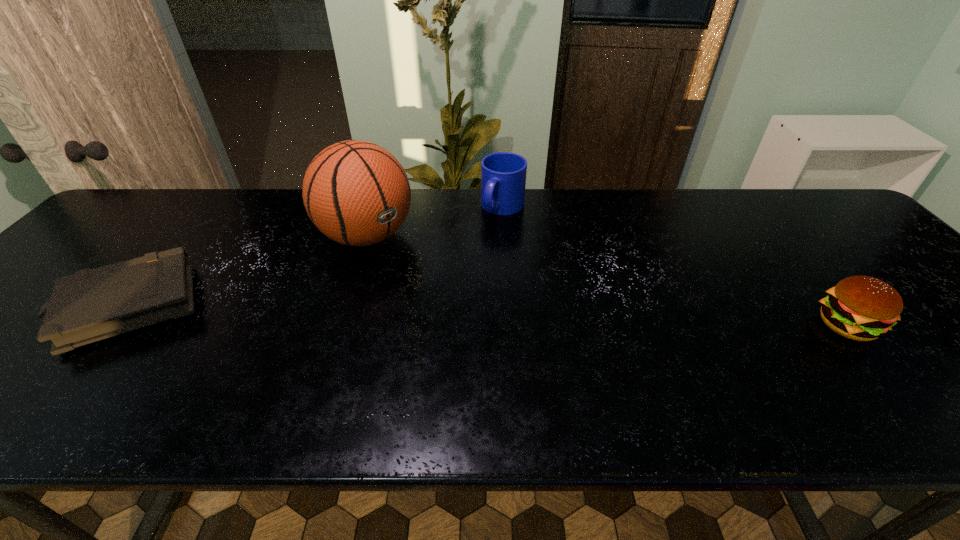
Identify the location of free spot between the leftmost object and the third object from left to right. This screenshot has height=540, width=960. (316, 256).

Identify the location of free area in between the hamburger and the third object from right to left. (607, 281).

You are a GUI agent. You are given a task and a screenshot of the screen. Output one action in this format:
    pyautogui.click(x=<x>, y=<y>)
    Task: Click on the free spot between the second object from left to right and the leftmost object
    Image resolution: width=960 pixels, height=540 pixels.
    Given the screenshot: What is the action you would take?
    pyautogui.click(x=248, y=271)

Where is `empty space between the Bible and the tallest object`? This screenshot has width=960, height=540. empty space between the Bible and the tallest object is located at coordinates (248, 271).

The width and height of the screenshot is (960, 540). What are the coordinates of `unoccupied area between the second object from right to left and the basketball` in the screenshot? It's located at (435, 222).

In order to click on free space between the mug and the basketball in this screenshot , I will do `click(435, 222)`.

The width and height of the screenshot is (960, 540). Find the location of `unoccupied area between the rightmost object and the leftmost object`. unoccupied area between the rightmost object and the leftmost object is located at coordinates (488, 316).

Locate an element on the screen. This screenshot has width=960, height=540. object that is the third closest to the third tallest object is located at coordinates (93, 304).

At what (x,y) coordinates should I click in order to perform the action: click on the third closest object to the shortest object. Please return your answer as a coordinate pair (x, y). This screenshot has height=540, width=960. Looking at the image, I should click on (862, 308).

You are a GUI agent. You are given a task and a screenshot of the screen. Output one action in this format:
    pyautogui.click(x=<x>, y=<y>)
    Task: Click on the blank space that satisfies the following two spatial constraints: 1. on the back side of the second object from left to right; 2. on the right side of the third object from left to right
    The image size is (960, 540).
    Given the screenshot: What is the action you would take?
    pyautogui.click(x=376, y=207)